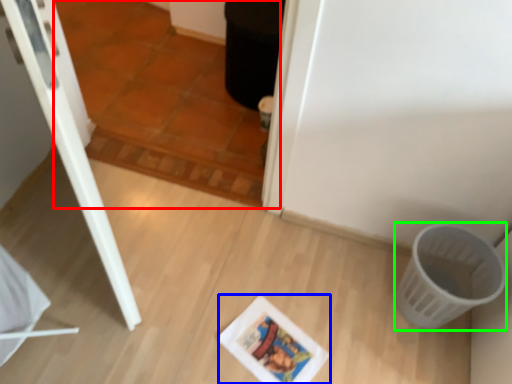
Question: Considering the real-world distances, which object is farthest from tile (highlighted by a red box)? comic book (highlighted by a blue box) or basket (highlighted by a green box)?

Choices:
 (A) comic book
 (B) basket

Answer: (B)